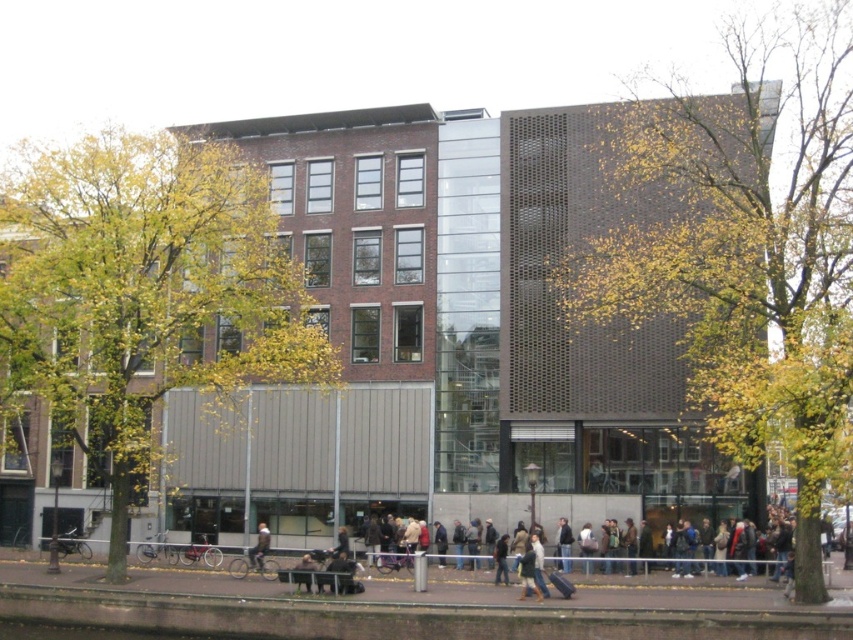
Question: Can you confirm if green leafy tree at right is thinner than dark blue jacket at center?

Choices:
 (A) no
 (B) yes

Answer: (A)

Question: Based on their relative distances, which object is farther from the green leafy tree at right?

Choices:
 (A) dark blue jacket at center
 (B) green leafy tree at center
 (C) dark blue jeans at center

Answer: (C)

Question: Which is nearer to the green leafy tree at center?

Choices:
 (A) dark blue jacket at center
 (B) green leafy tree at right
 (C) dark blue jeans at center

Answer: (C)

Question: Which object is closer to the camera taking this photo?

Choices:
 (A) green leafy tree at right
 (B) dark blue jeans at center

Answer: (A)

Question: Is green leafy tree at right bigger than dark blue jacket at center?

Choices:
 (A) no
 (B) yes

Answer: (B)

Question: Can you confirm if green leafy tree at right is positioned above dark blue jacket at center?

Choices:
 (A) no
 (B) yes

Answer: (B)